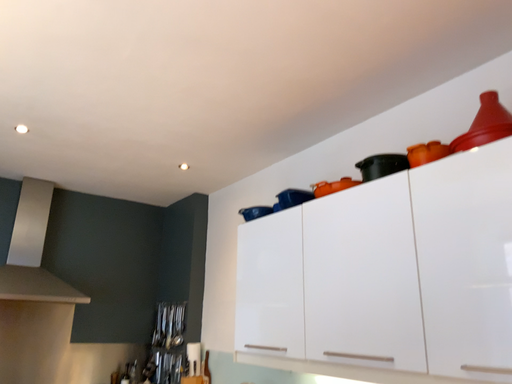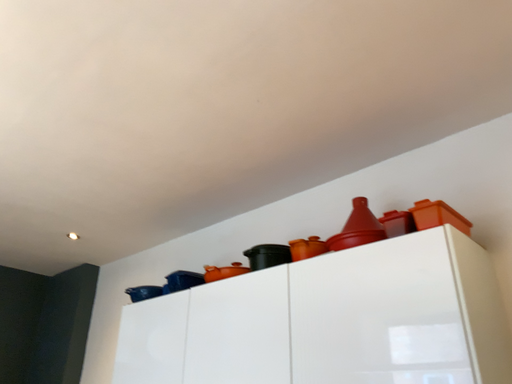
Question: How did the camera likely rotate when shooting the video?

Choices:
 (A) rotated upward
 (B) rotated downward

Answer: (A)